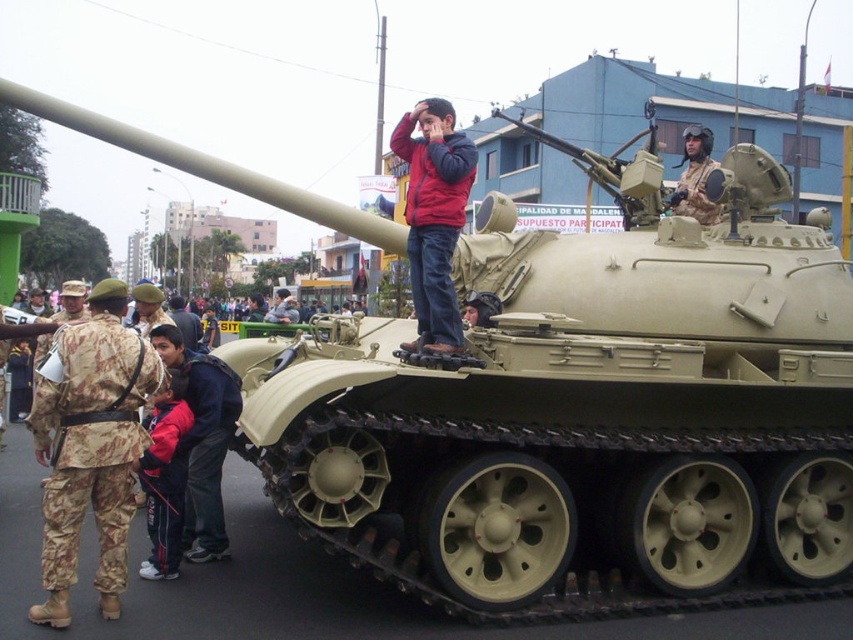
Question: Which point appears farthest from the camera in this image?

Choices:
 (A) (175, 428)
 (B) (38, 378)
 (C) (682, 198)
 (D) (421, 202)

Answer: (C)

Question: Does matte red jacket at center have a greater width compared to red fleece jacket at lower left?

Choices:
 (A) yes
 (B) no

Answer: (A)

Question: Among these points, which one is farthest from the camera?

Choices:
 (A) (82, 420)
 (B) (161, 428)

Answer: (B)

Question: Is camouflage fabric uniform at left positioned at the back of matte red jacket at center?

Choices:
 (A) yes
 (B) no

Answer: (B)

Question: Is the position of camouflage fabric uniform at left more distant than that of red fleece jacket at lower left?

Choices:
 (A) no
 (B) yes

Answer: (A)

Question: Based on their relative distances, which object is farther from the red fleece jacket at lower left?

Choices:
 (A) matte red jacket at center
 (B) camouflage fabric uniform at left

Answer: (A)